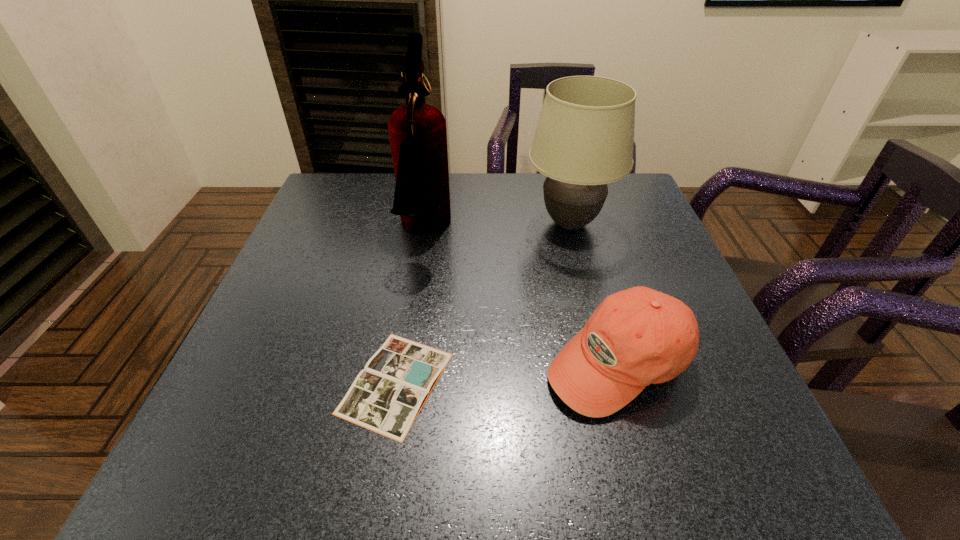
Where is `object that is the second closest to the shortest object`? object that is the second closest to the shortest object is located at coordinates (636, 337).

Identify which object is the closest to the third tallest object. Please provide its 2D coordinates. Your answer should be formatted as a tuple, i.e. [(x, y)], where the tuple contains the x and y coordinates of a point satisfying the conditions above.

[(386, 397)]

Where is `vacant position in the image that satisfies the following two spatial constraints: 1. at the nozzle of the fire extinguisher; 2. on the right side of the third tallest object`? This screenshot has height=540, width=960. vacant position in the image that satisfies the following two spatial constraints: 1. at the nozzle of the fire extinguisher; 2. on the right side of the third tallest object is located at coordinates (404, 362).

Where is `free space that satisfies the following two spatial constraints: 1. at the nozzle of the tallest object; 2. on the front side of the book`? The height and width of the screenshot is (540, 960). free space that satisfies the following two spatial constraints: 1. at the nozzle of the tallest object; 2. on the front side of the book is located at coordinates (401, 383).

Where is `vacant space that satisfies the following two spatial constraints: 1. on the back side of the second shortest object; 2. at the nozzle of the fire extinguisher`? The image size is (960, 540). vacant space that satisfies the following two spatial constraints: 1. on the back side of the second shortest object; 2. at the nozzle of the fire extinguisher is located at coordinates (581, 232).

Locate an element on the screen. The height and width of the screenshot is (540, 960). blank area in the image that satisfies the following two spatial constraints: 1. at the nozzle of the fire extinguisher; 2. on the back side of the second shortest object is located at coordinates (404, 362).

Identify the location of vacant area in the image that satisfies the following two spatial constraints: 1. on the back side of the third tallest object; 2. on the left side of the book. (399, 362).